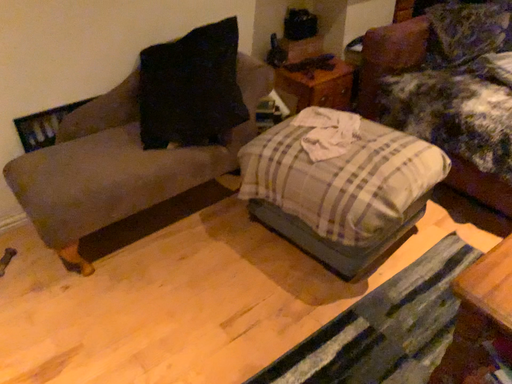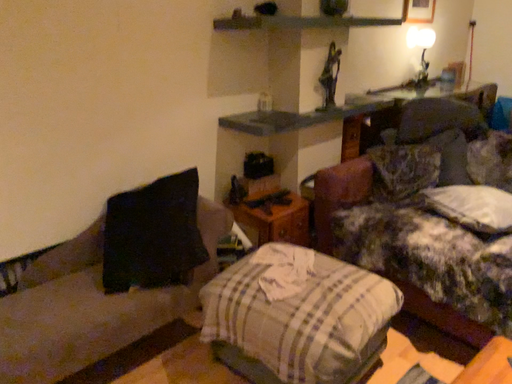
Question: How did the camera likely rotate when shooting the video?

Choices:
 (A) rotated upward
 (B) rotated downward

Answer: (A)